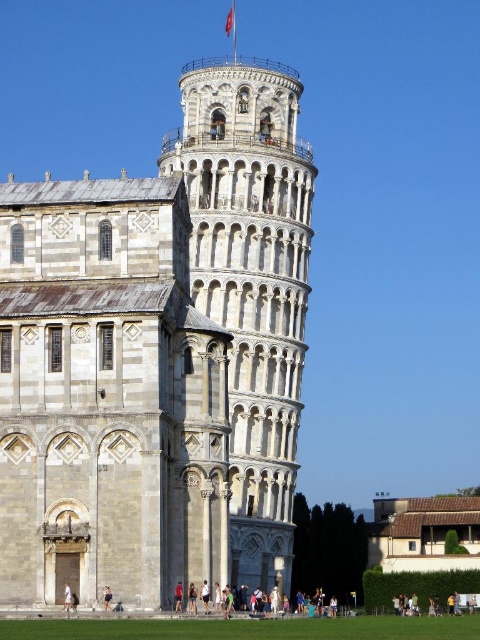
Between white fabric person at lower left and skinny jeans at center, which one is positioned higher?

skinny jeans at center is above.

Consider the image. Does white fabric person at lower left have a larger size compared to skinny jeans at center?

Correct, white fabric person at lower left is larger in size than skinny jeans at center.

This screenshot has height=640, width=480. I want to click on white fabric person at lower left, so click(68, 596).

Can you confirm if light brown wooden bench at lower center is wider than skinny jeans at center?

Yes, light brown wooden bench at lower center is wider than skinny jeans at center.

Who is more forward, (204, 602) or (107, 609)?

Point (107, 609) is in front.

This screenshot has height=640, width=480. I want to click on light brown wooden bench at lower center, so click(x=313, y=605).

In the scene shown: Which is above, white stone tower at center or light brown wooden bench at lower center?

white stone tower at center is above.

Is point (83, 413) more distant than point (228, 600)?

No, it is not.

This screenshot has width=480, height=640. What are the coordinates of `white stone tower at center` in the screenshot? It's located at (158, 355).